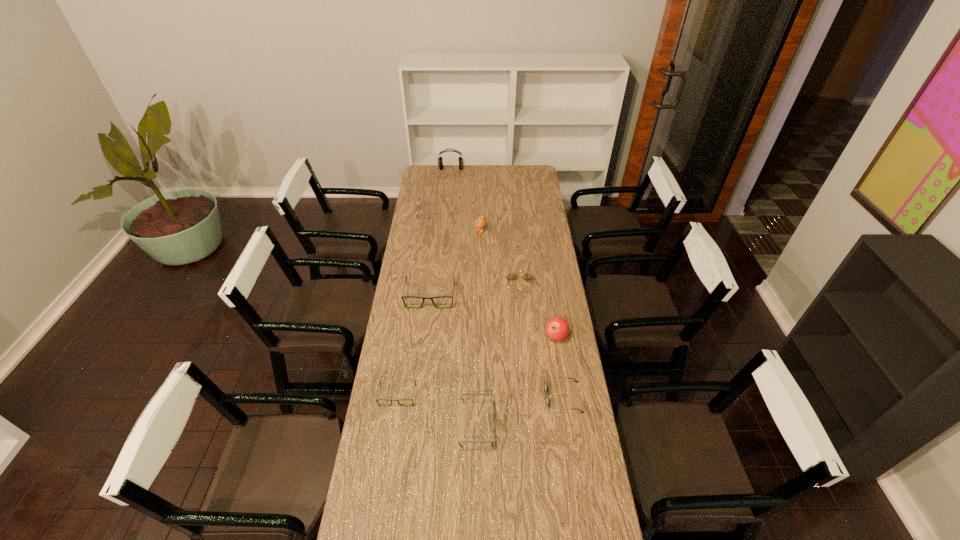
Where is `vacant region located on the left of the apple`? This screenshot has height=540, width=960. vacant region located on the left of the apple is located at coordinates (533, 336).

Locate an element on the screen. vacant area situated on the lens of the tallest spectacles is located at coordinates (427, 324).

Find the location of a particular element. vacant space located on the front-facing side of the farther yellow spectacles is located at coordinates (493, 213).

Find the location of a particular element. The height and width of the screenshot is (540, 960). vacant space situated on the lens of the rightmost black spectacles is located at coordinates (507, 426).

Where is `vacant area situated 0.370m on the front-facing side of the smaller yellow spectacles`? This screenshot has width=960, height=540. vacant area situated 0.370m on the front-facing side of the smaller yellow spectacles is located at coordinates (527, 361).

This screenshot has width=960, height=540. I want to click on vacant position located on the lens of the smallest black spectacles, so click(x=381, y=505).

Identify the location of vacant space situated on the front-facing side of the sunglasses. The height and width of the screenshot is (540, 960). (493, 397).

What are the coordinates of `vacant space situated on the front-facing side of the sunglasses` in the screenshot? It's located at (525, 397).

Find the location of a particular element. This screenshot has width=960, height=540. vacant region located 0.290m on the front-facing side of the sunglasses is located at coordinates (467, 397).

Where is `object that is at the far edge`? The height and width of the screenshot is (540, 960). object that is at the far edge is located at coordinates click(440, 162).